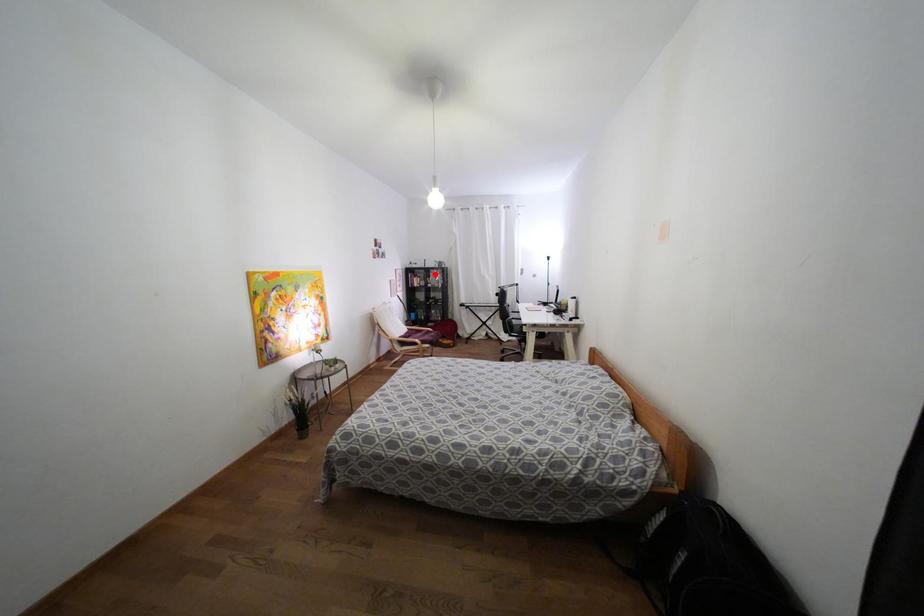
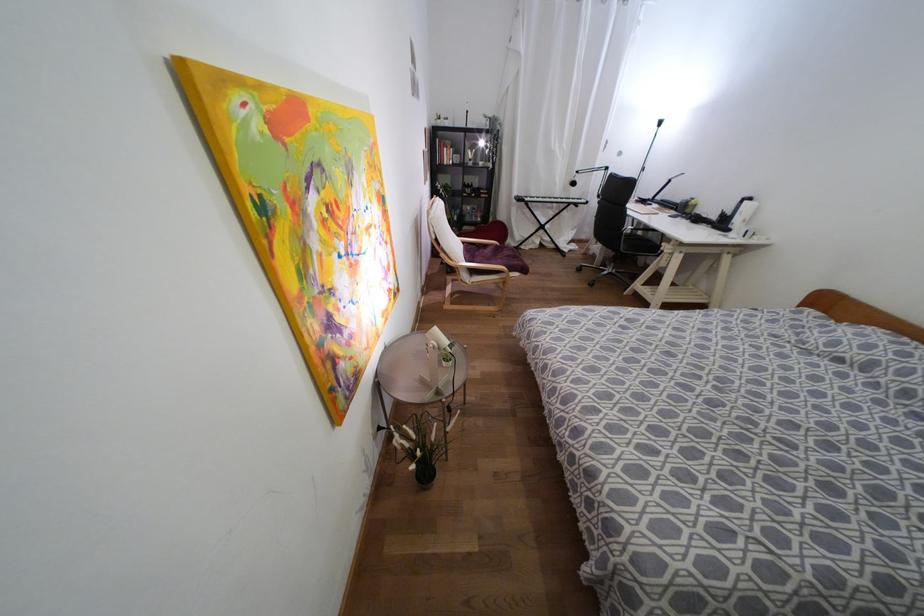
The point at the highlighted location is marked in the first image. Where is the corresponding point in the second image?

(480, 143)